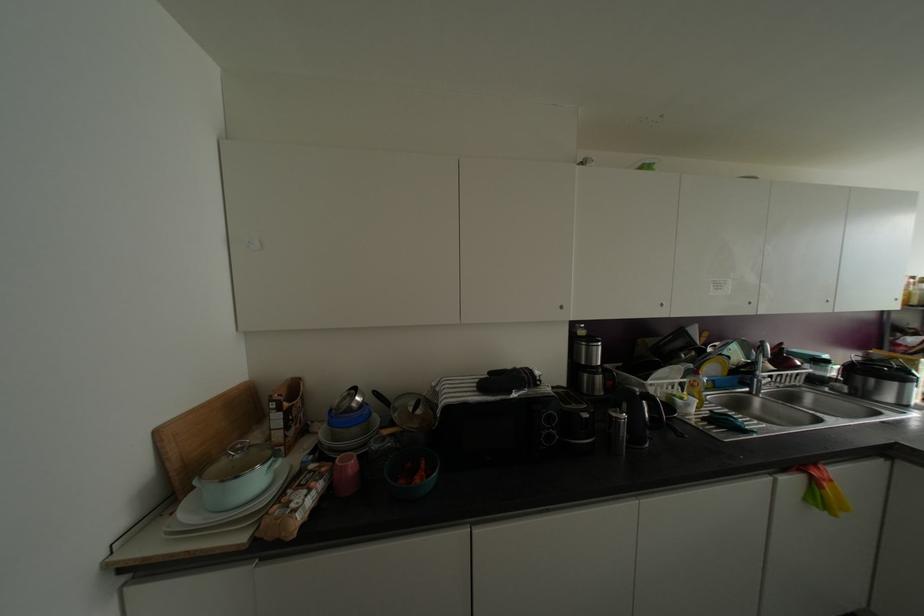
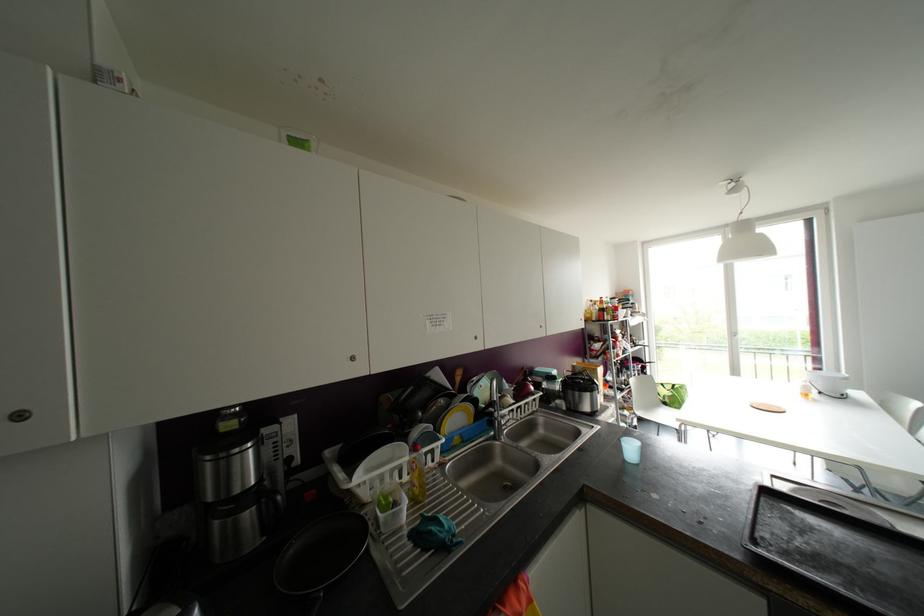
In the second image, find the point that corresponds to (759,381) in the first image.

(499, 422)